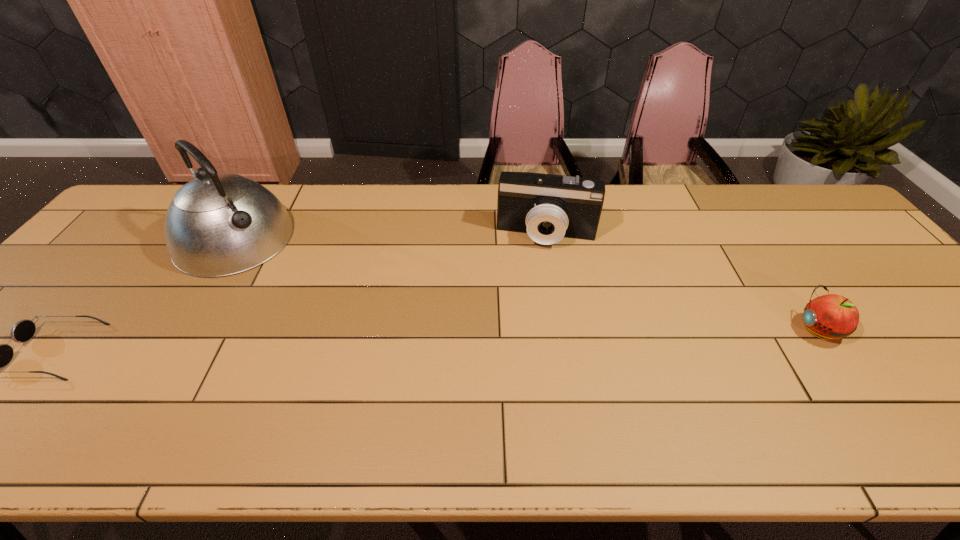
Locate an element on the screen. The height and width of the screenshot is (540, 960). vacant space located 0.190m on the lens of the second tallest object is located at coordinates (535, 300).

Where is `free location located on the lens of the second tallest object`? The image size is (960, 540). free location located on the lens of the second tallest object is located at coordinates (534, 303).

This screenshot has width=960, height=540. I want to click on vacant space located 0.400m from the spout of the kettle, so click(x=348, y=344).

Find the location of `vacant space located from the spout of the kettle`. vacant space located from the spout of the kettle is located at coordinates (310, 309).

Image resolution: width=960 pixels, height=540 pixels. I want to click on vacant space located 0.370m from the spout of the kettle, so click(341, 337).

Locate an element on the screen. The height and width of the screenshot is (540, 960). camcorder that is at the far edge is located at coordinates (547, 207).

The height and width of the screenshot is (540, 960). I want to click on kettle at the far edge, so click(219, 224).

The image size is (960, 540). In order to click on free space at the far edge of the desktop in this screenshot , I will do `click(307, 217)`.

Where is `vacant region at the near edge`? This screenshot has width=960, height=540. vacant region at the near edge is located at coordinates (159, 376).

What are the coordinates of `free spot at the left edge of the desktop` in the screenshot? It's located at (110, 263).